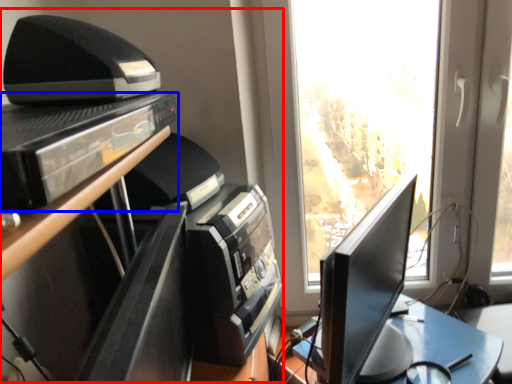
Question: Which object is closer to the camera taking this photo, entertainment center (highlighted by a red box) or shelf (highlighted by a blue box)?

Choices:
 (A) entertainment center
 (B) shelf

Answer: (B)